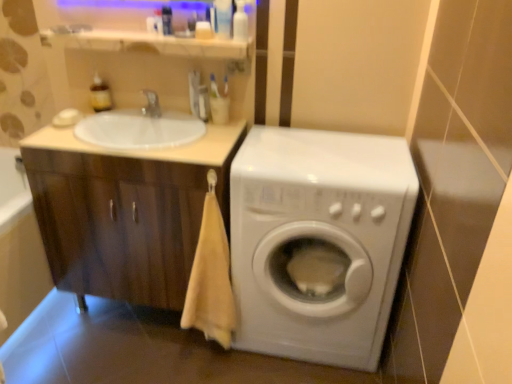
The height and width of the screenshot is (384, 512). Find the location of `free space to the left of white glossy tap at upper center`. free space to the left of white glossy tap at upper center is located at coordinates (119, 117).